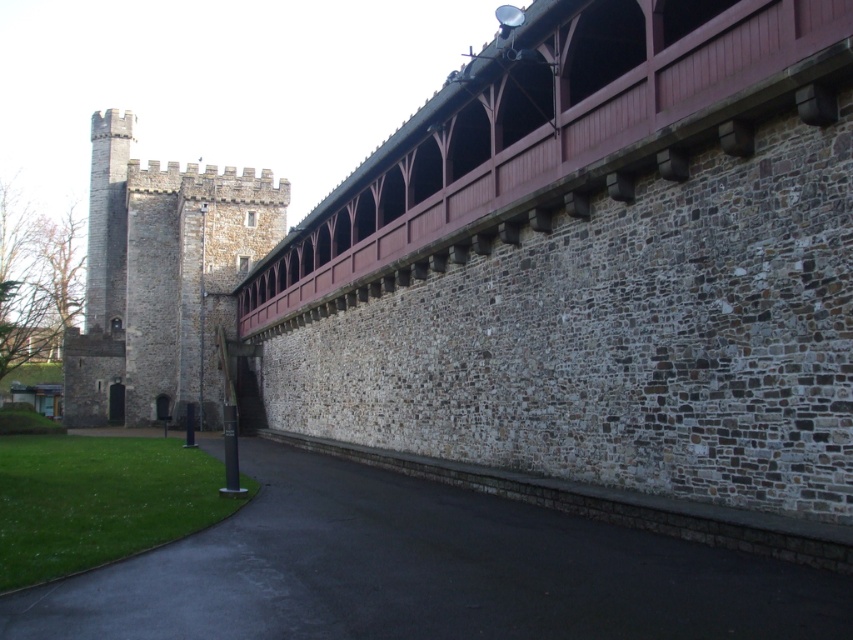
You are standing at point [425,572] on the image. What object are you standing on?

You are standing on the black asphalt path at lower center.